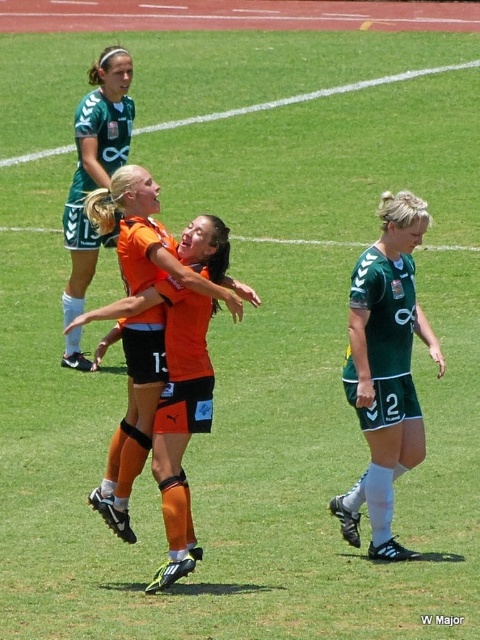
You are a photographer at the soccer match. You want to take a photo of the two players in their green matte jersey at center and orange matte jersey at center. Which player should you focus on first if you want to capture the taller player in the frame?

The orange matte jersey at center is taller than the green matte jersey at center, so you should focus on the player in the orange matte jersey at center first to capture the taller player in the frame.

You are a photographer standing at the camera position. You want to take a photo of the point at coordinates (191, 285). The soccer field has a safety rule that requires photographers to stay at least 5 meters away from any active play area. Is your current position compliant with this rule?

The distance between the camera and the point at coordinates (191, 285) is 6.94 meters, which exceeds the minimum required distance of 5 meters. Therefore, your current position is compliant with the safety rule.